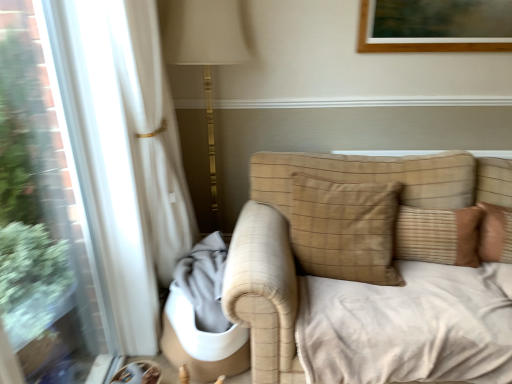
The width and height of the screenshot is (512, 384). I want to click on beige textured pillow at center, placed as the 1th pillow when sorted from left to right, so click(345, 229).

Describe the element at coordinates (345, 229) in the screenshot. I see `beige textured pillow at center, placed as the 1th pillow when sorted from left to right` at that location.

Describe the element at coordinates (438, 235) in the screenshot. I see `brown textured pillow at center, which is the 1th pillow from right to left` at that location.

This screenshot has height=384, width=512. Identify the location of brown textured pillow at center, which is the 1th pillow from right to left. (438, 235).

Find the location of a particular element. The height and width of the screenshot is (384, 512). beige textured pillow at center, placed as the 1th pillow when sorted from left to right is located at coordinates (345, 229).

Based on the photo, considering the positions of objects brown textured pillow at center, which is the 1th pillow from right to left, and beige textured pillow at center, which is counted as the 2th pillow, starting from the right, in the image provided, who is more to the right, brown textured pillow at center, which is the 1th pillow from right to left, or beige textured pillow at center, which is counted as the 2th pillow, starting from the right,?

Positioned to the right is brown textured pillow at center, which is the 1th pillow from right to left.

Is brown textured pillow at center, the second pillow positioned from the left, further to camera compared to beige textured pillow at center, placed as the 1th pillow when sorted from left to right?

Yes, brown textured pillow at center, the second pillow positioned from the left, is further from the viewer.

Considering the points (459, 255) and (338, 186), which point is behind, point (459, 255) or point (338, 186)?

The point (338, 186) is farther.

From the picture: From the image's perspective, which one is positioned higher, brown textured pillow at center, which is the 1th pillow from right to left, or beige textured pillow at center, placed as the 1th pillow when sorted from left to right?

beige textured pillow at center, placed as the 1th pillow when sorted from left to right, from the image's perspective.

From a real-world perspective, which is physically below, brown textured pillow at center, the second pillow positioned from the left, or beige textured pillow at center, placed as the 1th pillow when sorted from left to right?

brown textured pillow at center, the second pillow positioned from the left.

Which of these two, brown textured pillow at center, which is the 1th pillow from right to left, or beige textured pillow at center, placed as the 1th pillow when sorted from left to right, is wider?

With larger width is beige textured pillow at center, placed as the 1th pillow when sorted from left to right.

Who is taller, brown textured pillow at center, the second pillow positioned from the left, or beige textured pillow at center, which is counted as the 2th pillow, starting from the right?

beige textured pillow at center, which is counted as the 2th pillow, starting from the right.

Which of these two, brown textured pillow at center, the second pillow positioned from the left, or beige textured pillow at center, which is counted as the 2th pillow, starting from the right, is bigger?

beige textured pillow at center, which is counted as the 2th pillow, starting from the right.

Based on the photo, would you say brown textured pillow at center, the second pillow positioned from the left, contains beige textured pillow at center, which is counted as the 2th pillow, starting from the right?

That's incorrect, beige textured pillow at center, which is counted as the 2th pillow, starting from the right, is not inside brown textured pillow at center, the second pillow positioned from the left.

Looking at this image, would you consider brown textured pillow at center, the second pillow positioned from the left, to be distant from beige textured pillow at center, placed as the 1th pillow when sorted from left to right?

No, brown textured pillow at center, the second pillow positioned from the left, is in close proximity to beige textured pillow at center, placed as the 1th pillow when sorted from left to right.

Is brown textured pillow at center, which is the 1th pillow from right to left, positioned with its back to beige textured pillow at center, which is counted as the 2th pillow, starting from the right?

No, brown textured pillow at center, which is the 1th pillow from right to left, is not facing away from beige textured pillow at center, which is counted as the 2th pillow, starting from the right.

Can you tell me how much brown textured pillow at center, which is the 1th pillow from right to left, and beige textured pillow at center, placed as the 1th pillow when sorted from left to right, differ in facing direction?

brown textured pillow at center, which is the 1th pillow from right to left, and beige textured pillow at center, placed as the 1th pillow when sorted from left to right, are facing 1.22 degrees away from each other.

How distant is brown textured pillow at center, the second pillow positioned from the left, from beige textured pillow at center, placed as the 1th pillow when sorted from left to right?

The distance of brown textured pillow at center, the second pillow positioned from the left, from beige textured pillow at center, placed as the 1th pillow when sorted from left to right, is 9.85 inches.

Identify the location of pillow in front of the brown textured pillow at center, the second pillow positioned from the left. This screenshot has height=384, width=512. (345, 229).

Is beige textured pillow at center, placed as the 1th pillow when sorted from left to right, to the left or to the right of brown textured pillow at center, which is the 1th pillow from right to left, in the image?

In the image, beige textured pillow at center, placed as the 1th pillow when sorted from left to right, appears on the left side of brown textured pillow at center, which is the 1th pillow from right to left.

Which object is closer to the camera, beige textured pillow at center, which is counted as the 2th pillow, starting from the right, or brown textured pillow at center, which is the 1th pillow from right to left?

Positioned in front is beige textured pillow at center, which is counted as the 2th pillow, starting from the right.

Which point is more distant from viewer, (338, 227) or (405, 238)?

Point (405, 238)

From the image's perspective, is beige textured pillow at center, which is counted as the 2th pillow, starting from the right, above or below brown textured pillow at center, which is the 1th pillow from right to left?

beige textured pillow at center, which is counted as the 2th pillow, starting from the right, is above brown textured pillow at center, which is the 1th pillow from right to left.

From a real-world perspective, who is located lower, beige textured pillow at center, placed as the 1th pillow when sorted from left to right, or brown textured pillow at center, the second pillow positioned from the left?

From a 3D spatial view, brown textured pillow at center, the second pillow positioned from the left, is below.

Considering the sizes of objects beige textured pillow at center, placed as the 1th pillow when sorted from left to right, and brown textured pillow at center, which is the 1th pillow from right to left, in the image provided, who is wider, beige textured pillow at center, placed as the 1th pillow when sorted from left to right, or brown textured pillow at center, which is the 1th pillow from right to left,?

With larger width is beige textured pillow at center, placed as the 1th pillow when sorted from left to right.

Is beige textured pillow at center, placed as the 1th pillow when sorted from left to right, taller or shorter than brown textured pillow at center, which is the 1th pillow from right to left?

Clearly, beige textured pillow at center, placed as the 1th pillow when sorted from left to right, is taller compared to brown textured pillow at center, which is the 1th pillow from right to left.

Which of these two, beige textured pillow at center, which is counted as the 2th pillow, starting from the right, or brown textured pillow at center, which is the 1th pillow from right to left, is bigger?

Bigger between the two is beige textured pillow at center, which is counted as the 2th pillow, starting from the right.

Can brown textured pillow at center, which is the 1th pillow from right to left, be found inside beige textured pillow at center, placed as the 1th pillow when sorted from left to right?

No.

Is there a large distance between beige textured pillow at center, which is counted as the 2th pillow, starting from the right, and brown textured pillow at center, which is the 1th pillow from right to left?

beige textured pillow at center, which is counted as the 2th pillow, starting from the right, is actually quite close to brown textured pillow at center, which is the 1th pillow from right to left.

Is beige textured pillow at center, which is counted as the 2th pillow, starting from the right, aimed at brown textured pillow at center, the second pillow positioned from the left?

No, beige textured pillow at center, which is counted as the 2th pillow, starting from the right, is not turned towards brown textured pillow at center, the second pillow positioned from the left.

Where is `pillow below the beige textured pillow at center, placed as the 1th pillow when sorted from left to right (from a real-world perspective)`? The height and width of the screenshot is (384, 512). pillow below the beige textured pillow at center, placed as the 1th pillow when sorted from left to right (from a real-world perspective) is located at coordinates 438,235.

Find the location of `pillow on the left of brown textured pillow at center, the second pillow positioned from the left`. pillow on the left of brown textured pillow at center, the second pillow positioned from the left is located at coordinates (345, 229).

You are a GUI agent. You are given a task and a screenshot of the screen. Output one action in this format:
    pyautogui.click(x=<x>, y=<y>)
    Task: Click on the pillow in front of the brown textured pillow at center, the second pillow positioned from the left
    
    Given the screenshot: What is the action you would take?
    [x=345, y=229]